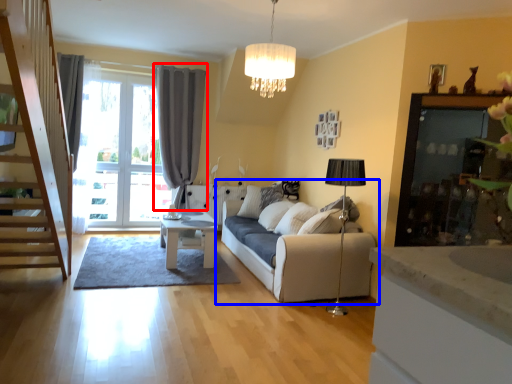
Question: Which of the following is the closest to the observer, curtain (highlighted by a red box) or studio couch (highlighted by a blue box)?

Choices:
 (A) curtain
 (B) studio couch

Answer: (B)